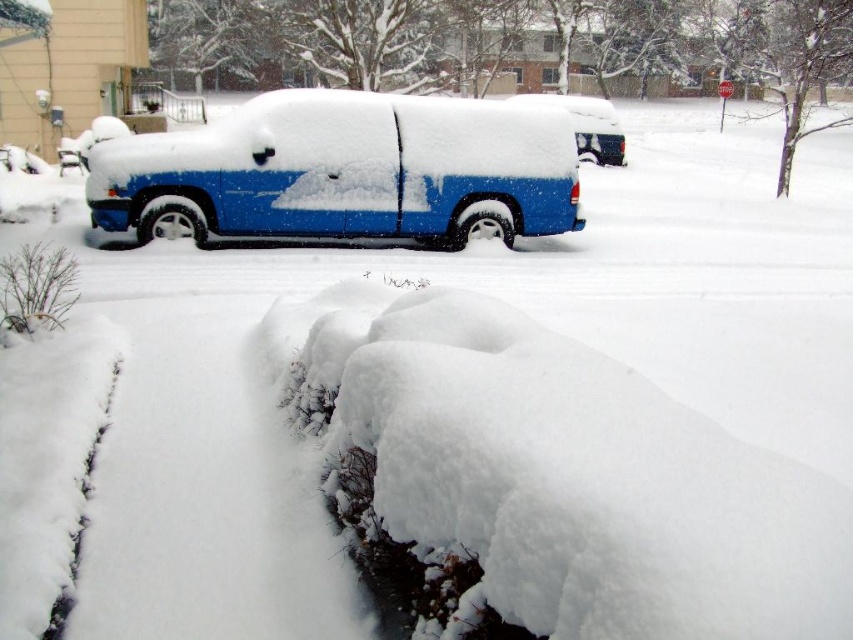
Can you confirm if blue matte van at upper center is taller than white snow curb at lower left?

Indeed, blue matte van at upper center has a greater height compared to white snow curb at lower left.

Does blue matte van at upper center appear over white snow curb at lower left?

Correct, blue matte van at upper center is located above white snow curb at lower left.

Who is more forward, (590, 122) or (70, 577)?

Positioned in front is point (70, 577).

Where is `blue matte van at upper center`? The height and width of the screenshot is (640, 853). blue matte van at upper center is located at coordinates (589, 125).

Which is more to the right, blue matte van at center or white snow curb at lower left?

blue matte van at center is more to the right.

Which of these two, blue matte van at center or white snow curb at lower left, stands shorter?

white snow curb at lower left is shorter.

Which is in front, point (137, 157) or point (105, 432)?

Point (105, 432)

This screenshot has height=640, width=853. What are the coordinates of `blue matte van at center` in the screenshot? It's located at (345, 170).

Who is higher up, blue matte van at center or blue matte van at upper center?

Positioned higher is blue matte van at upper center.

Which of these two, blue matte van at center or blue matte van at upper center, stands shorter?

blue matte van at center

Consider the image. Measure the distance between point (265, 96) and camera.

The distance of point (265, 96) from camera is 26.52 feet.

I want to click on blue matte van at center, so [x=345, y=170].